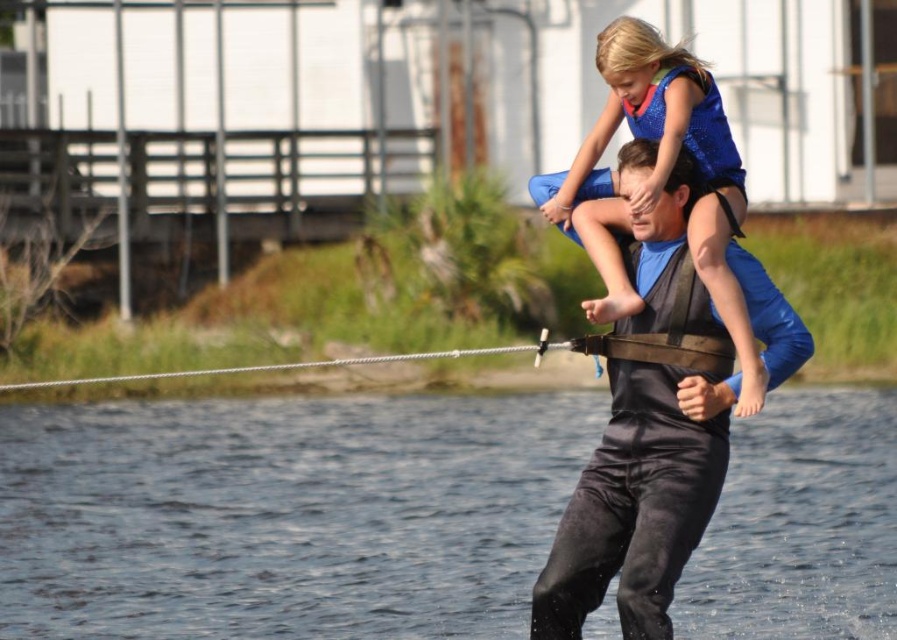
You are a photographer trying to capture the water skiing scene. You notice a point marked at coordinates (284, 515). Based on the scene description, what is the most likely object or feature located at that point?

The point at coordinates (284, 515) marks clear water at center.

You are a lifeguard standing at the edge of the water. You notice a point at coordinates (642, 468) in the image. Is this point located on the black matte life vest at center?

Yes, the point at coordinates (642, 468) is located on the black matte life vest at center.

Based on the scene, which object is positioned to the right when you look at the black matte life vest at center and the clear water at center?

→ The black matte life vest at center is to the right of the clear water at center.